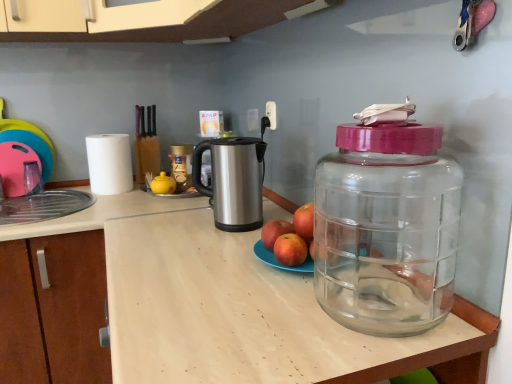
Describe the element at coordinates (290, 250) in the screenshot. The height and width of the screenshot is (384, 512). I see `red matte apple at center, positioned as the second apple in right-to-left order` at that location.

Find the location of `red matte apple at center, the first apple positioned from the left`. red matte apple at center, the first apple positioned from the left is located at coordinates (275, 232).

Describe the element at coordinates (386, 228) in the screenshot. I see `transparent plastic bottle at right, the second bottle viewed from the back` at that location.

Identify the location of white matte paper towel at left. The image size is (512, 384). (109, 163).

In the scene shown: Measure the distance between white matte paper towel at left and camera.

The depth of white matte paper towel at left is 5.43 feet.

Where is `metallic gold jar at center, the 1th bottle from the back`? This screenshot has height=384, width=512. metallic gold jar at center, the 1th bottle from the back is located at coordinates (182, 165).

Where is `red matte apple at center, positioned as the second apple in right-to-left order`? red matte apple at center, positioned as the second apple in right-to-left order is located at coordinates (290, 250).

Identify the location of paper towel located on the left of red matte apple at center, the first apple positioned from the left. (109, 163).

Considering the sizes of objects red matte apple at center, the first apple positioned from the left, and white matte paper towel at left in the image provided, who is smaller, red matte apple at center, the first apple positioned from the left, or white matte paper towel at left?

With smaller size is red matte apple at center, the first apple positioned from the left.

Does red matte apple at center, the first apple positioned from the left, lie behind white matte paper towel at left?

Result: No, it is not.

How much distance is there between red matte apple at center, the first apple positioned from the left, and white matte paper towel at left?

red matte apple at center, the first apple positioned from the left, is 35.59 inches from white matte paper towel at left.

Is pink rubber toy at left far from red matte apple at center, the first apple positioned from the left?

Yes, pink rubber toy at left and red matte apple at center, the first apple positioned from the left, are located far from each other.

Does pink rubber toy at left lie in front of red matte apple at center, the 3th apple viewed from the right?

That is False.

I want to click on toy behind the red matte apple at center, the 3th apple viewed from the right, so click(x=22, y=153).

From the image's perspective, is light wood at center, the 1th counter top from the back, beneath metallic gold jar at center, the 1th bottle from the back?

Yes, from the image's perspective, light wood at center, the 1th counter top from the back, is beneath metallic gold jar at center, the 1th bottle from the back.

From the picture: Considering the sizes of objects metallic gold jar at center, which is the first bottle in left-to-right order, and white matte paper towel at left in the image provided, who is taller, metallic gold jar at center, which is the first bottle in left-to-right order, or white matte paper towel at left?

Standing taller between the two is white matte paper towel at left.

In terms of size, does metallic gold jar at center, which is the 2th bottle in front-to-back order, appear bigger or smaller than white matte paper towel at left?

metallic gold jar at center, which is the 2th bottle in front-to-back order, is smaller than white matte paper towel at left.

Consider the image. Is metallic gold jar at center, the second bottle positioned from the right, in front of or behind white matte paper towel at left in the image?

In the image, metallic gold jar at center, the second bottle positioned from the right, appears behind white matte paper towel at left.

Considering the sizes of objects transparent wood counter top at center, the 1th counter top positioned from the front, and metallic gold jar at center, which is the first bottle in left-to-right order, in the image provided, who is bigger, transparent wood counter top at center, the 1th counter top positioned from the front, or metallic gold jar at center, which is the first bottle in left-to-right order,?

transparent wood counter top at center, the 1th counter top positioned from the front, is bigger.

Looking at this image, does transparent wood counter top at center, the 1th counter top positioned from the front, have a greater width compared to metallic gold jar at center, which is the first bottle in left-to-right order?

Yes.

Is point (423, 354) closer to camera compared to point (182, 175)?

Yes, it is in front of point (182, 175).

Considering the positions of point (204, 252) and point (279, 227), is point (204, 252) closer or farther from the camera than point (279, 227)?

Point (204, 252) is farther from the camera than point (279, 227).

Which object is closer to the camera taking this photo, transparent wood counter top at center, positioned as the second counter top in back-to-front order, or red matte apple at center, the first apple positioned from the left?

transparent wood counter top at center, positioned as the second counter top in back-to-front order, is closer to the camera.

How different are the orientations of transparent wood counter top at center, positioned as the second counter top in back-to-front order, and red matte apple at center, the 3th apple viewed from the right, in degrees?

transparent wood counter top at center, positioned as the second counter top in back-to-front order, and red matte apple at center, the 3th apple viewed from the right, are facing 0.365 degrees away from each other.

Is red matte apple at center, the first apple positioned from the left, at the back of transparent wood counter top at center, positioned as the second counter top in back-to-front order?

No, transparent wood counter top at center, positioned as the second counter top in back-to-front order,'s orientation is not away from red matte apple at center, the first apple positioned from the left.

In the image, is silver metallic kettle at center on the left side or the right side of white matte paper towel at left?

From the image, it's evident that silver metallic kettle at center is to the right of white matte paper towel at left.

Are silver metallic kettle at center and white matte paper towel at left beside each other?

No, silver metallic kettle at center is not touching white matte paper towel at left.

Does point (209, 202) come closer to viewer compared to point (129, 161)?

Yes.

The width and height of the screenshot is (512, 384). I want to click on paper towel above the red matte apple at center, the first apple positioned from the left (from the image's perspective), so click(x=109, y=163).

The width and height of the screenshot is (512, 384). I want to click on toy on the left of red matte apple at center, the first apple positioned from the left, so click(x=22, y=153).

From the image, which object appears to be farther from pink rubber toy at left, light wood at center, the second counter top positioned from the front, or transparent wood counter top at center, the 1th counter top positioned from the front?

transparent wood counter top at center, the 1th counter top positioned from the front, is positioned further to the anchor pink rubber toy at left.

Which object lies further to the anchor point pink rubber toy at left, transparent wood counter top at center, the 1th counter top positioned from the front, or white matte paper towel at left?

Based on the image, transparent wood counter top at center, the 1th counter top positioned from the front, appears to be further to pink rubber toy at left.

Estimate the real-world distances between objects in this image. Which object is closer to transparent wood counter top at center, the 1th counter top positioned from the front, red matte apple at center, the 1th apple positioned from the right, or metallic gold jar at center, the second bottle positioned from the right?

red matte apple at center, the 1th apple positioned from the right, lies closer to transparent wood counter top at center, the 1th counter top positioned from the front, than the other object.

Looking at the image, which one is located closer to pink rubber toy at left, transparent plastic bottle at right, arranged as the 1th bottle when viewed from the front, or light wood at center, the 1th counter top from the back?

light wood at center, the 1th counter top from the back, is positioned closer to the anchor pink rubber toy at left.

From the image, which object appears to be farther from pink rubber toy at left, red matte apple at center, the first apple positioned from the left, or light wood at center, the second counter top positioned from the front?

red matte apple at center, the first apple positioned from the left, is further to pink rubber toy at left.

When comparing their distances from silver metallic kettle at center, does red matte apple at center, the first apple positioned from the left, or red matte apple at center, which appears as the second apple when viewed from the left, seem closer?

The object closer to silver metallic kettle at center is red matte apple at center, the first apple positioned from the left.

Based on the photo, estimate the real-world distances between objects in this image. Which object is further from red matte apple at center, positioned as the second apple in right-to-left order, light wood at center, the second counter top positioned from the front, or red matte apple at center, which is the 3th apple from left to right?

light wood at center, the second counter top positioned from the front, lies further to red matte apple at center, positioned as the second apple in right-to-left order, than the other object.

From the image, which object appears to be nearer to silver metallic kettle at center, red matte apple at center, the 3th apple viewed from the right, or transparent plastic bottle at right, which ranks as the 2th bottle in left-to-right order?

red matte apple at center, the 3th apple viewed from the right, is positioned closer to the anchor silver metallic kettle at center.

This screenshot has height=384, width=512. In order to click on toy between transparent wood counter top at center, positioned as the second counter top in back-to-front order, and metallic gold jar at center, which is the 2th bottle in front-to-back order, along the z-axis in this screenshot , I will do `click(22, 153)`.

Locate an element on the screen. This screenshot has height=384, width=512. appliance between pink rubber toy at left and red matte apple at center, positioned as the second apple in right-to-left order, from left to right is located at coordinates (233, 181).

The width and height of the screenshot is (512, 384). I want to click on bottle situated between pink rubber toy at left and silver metallic kettle at center from left to right, so click(182, 165).

Identify the location of appliance located between transparent plastic bottle at right, the second bottle viewed from the back, and white matte paper towel at left in the depth direction. The image size is (512, 384). (233, 181).